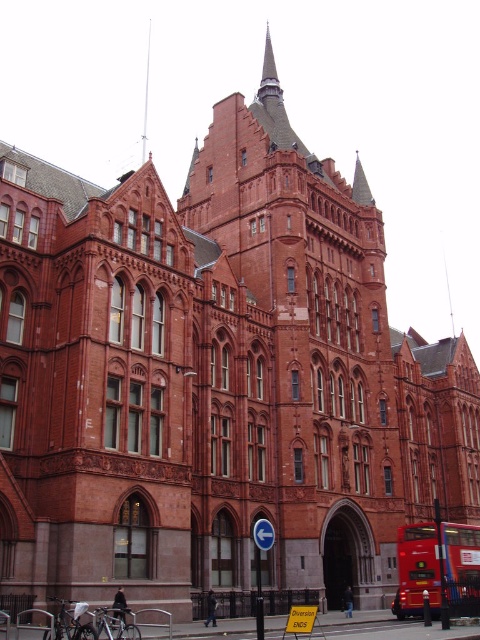
Which is more to the left, red metallic bus at lower right or smooth silver spire at upper center?

smooth silver spire at upper center is more to the left.

Which of these two, red metallic bus at lower right or smooth silver spire at upper center, stands taller?

With more height is smooth silver spire at upper center.

The image size is (480, 640). What are the coordinates of `red metallic bus at lower right` in the screenshot? It's located at (417, 570).

At what (x,y) coordinates should I click in order to perform the action: click on red metallic bus at lower right. Please return your answer as a coordinate pair (x, y). The height and width of the screenshot is (640, 480). Looking at the image, I should click on click(417, 570).